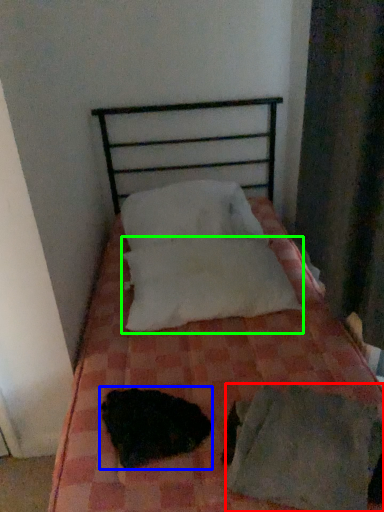
Question: Which object is the closest to the sheet (highlighted by a red box)? Choose among these: animal (highlighted by a blue box) or pillow (highlighted by a green box).

Choices:
 (A) animal
 (B) pillow

Answer: (A)